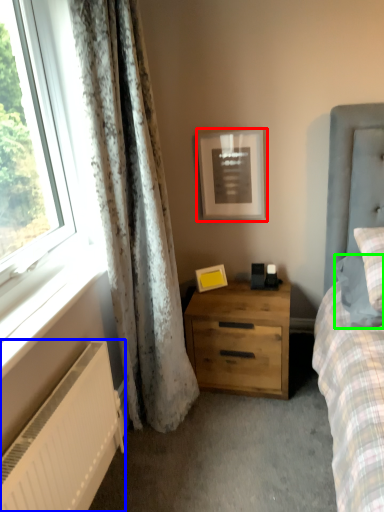
Question: Considering the real-world distances, which object is closest to picture frame (highlighted by a red box)? radiator (highlighted by a blue box) or pillow (highlighted by a green box).

Choices:
 (A) radiator
 (B) pillow

Answer: (B)